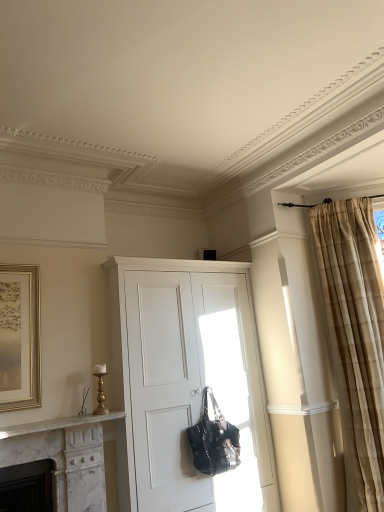
Question: Would you say beige textured curtain at right is inside or outside black leather handbag at center?

Choices:
 (A) inside
 (B) outside

Answer: (B)

Question: Considering the positions of beige textured curtain at right and black leather handbag at center in the image, is beige textured curtain at right taller or shorter than black leather handbag at center?

Choices:
 (A) tall
 (B) short

Answer: (A)

Question: Which of these objects is positioned farthest from the black leather handbag at center?

Choices:
 (A) beige textured curtain at right
 (B) white matte cabinet at center

Answer: (A)

Question: Considering the real-world distances, which object is closest to the beige textured curtain at right?

Choices:
 (A) white matte cabinet at center
 (B) black leather handbag at center

Answer: (A)